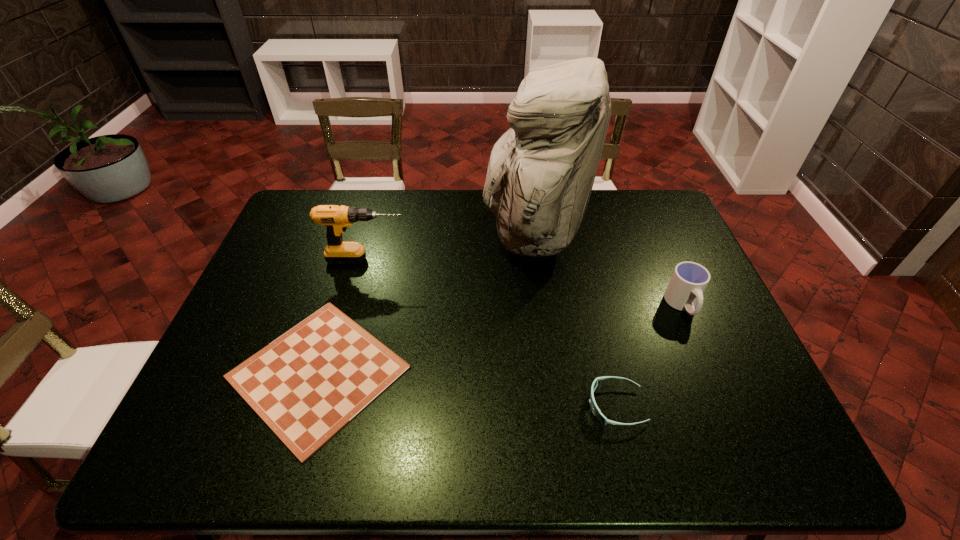
Find the location of `object at the near left corner`. object at the near left corner is located at coordinates (308, 384).

Find the location of a particular element. The height and width of the screenshot is (540, 960). vacant space at the far edge of the desktop is located at coordinates (398, 217).

Where is `vacant space at the near edge`? vacant space at the near edge is located at coordinates (380, 428).

Locate an element on the screen. blank space at the left edge of the desktop is located at coordinates (267, 294).

Identify the location of vacant space at the right edge. (775, 413).

In order to click on vacant area at the far left corner in this screenshot , I will do `click(333, 194)`.

The width and height of the screenshot is (960, 540). I want to click on vacant space at the far right corner of the desktop, so (x=634, y=201).

I want to click on vacant space at the near right corner of the desktop, so click(x=783, y=433).

Locate an element on the screen. free spot between the tallest object and the third tallest object is located at coordinates (608, 269).

Identify the location of vacant area that lies between the checkerboard and the rightmost object. (500, 339).